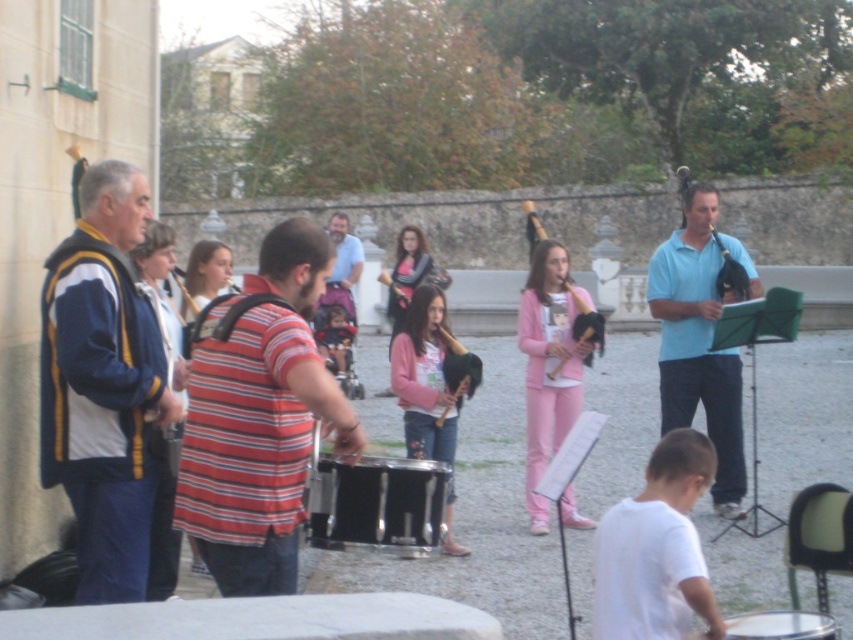
Does black metallic drum at center appear under black drum at lower right?

No.

Describe the element at coordinates (376, 502) in the screenshot. I see `black metallic drum at center` at that location.

This screenshot has width=853, height=640. I want to click on black metallic drum at center, so click(376, 502).

Who is more distant from viewer, (148, 477) or (693, 234)?

Positioned behind is point (693, 234).

Locate an element on the screen. This screenshot has width=853, height=640. blue and yellow jacket at left is located at coordinates (103, 384).

Which is more to the right, striped cotton shirt at center or black drum at lower right?

Positioned to the right is black drum at lower right.

Is point (283, 476) farther from camera compared to point (746, 616)?

No, it is in front of (746, 616).

Find the location of a particular element. This screenshot has height=640, width=853. striped cotton shirt at center is located at coordinates (258, 417).